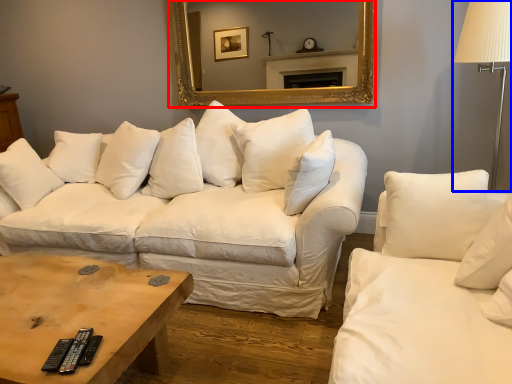
Question: Among these objects, which one is nearest to the camera, mirror (highlighted by a red box) or table lamp (highlighted by a blue box)?

Choices:
 (A) mirror
 (B) table lamp

Answer: (B)